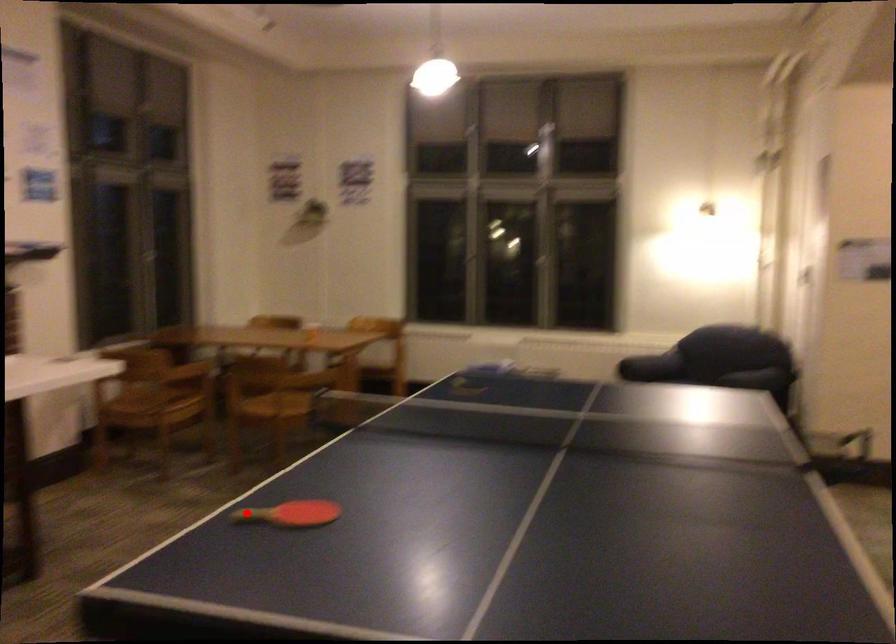
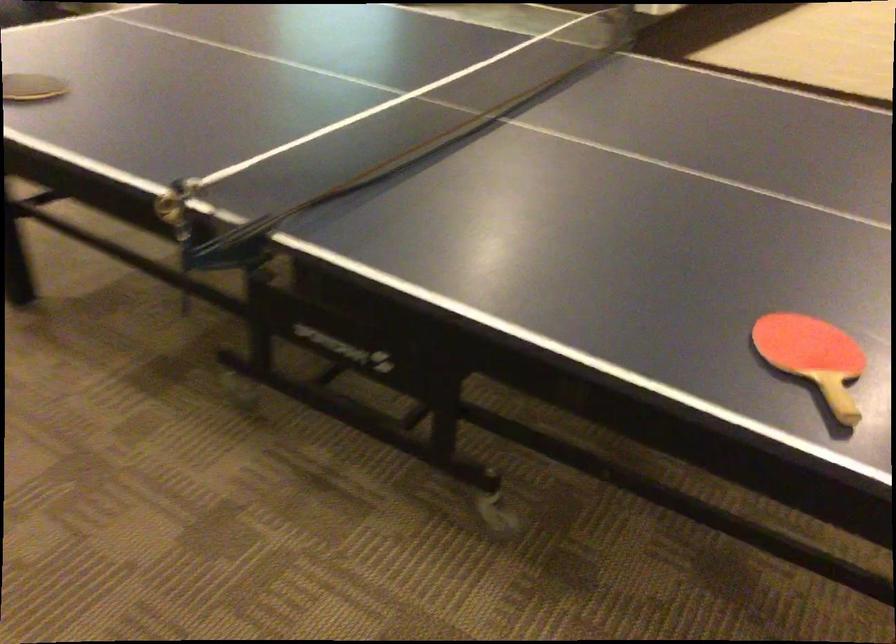
Question: I am providing you with two images of the same scene from different viewpoints. A red point is marked on the first image. Is the red point's position out of view in image 2?

Choices:
 (A) Yes
 (B) No

Answer: (B)